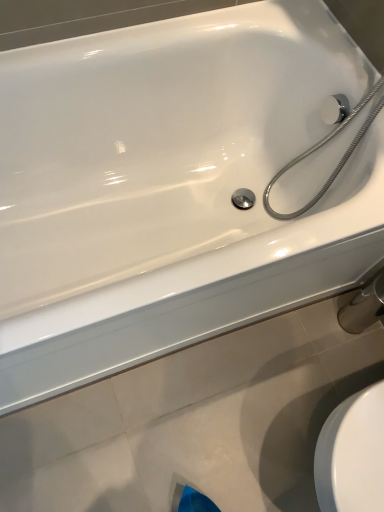
Question: Should I look upward or downward to see chrome metallic faucet at lower right?

Choices:
 (A) up
 (B) down

Answer: (B)

Question: Considering the relative sizes of chrome metallic shower head at upper right and chrome metallic faucet at lower right in the image provided, is chrome metallic shower head at upper right taller than chrome metallic faucet at lower right?

Choices:
 (A) no
 (B) yes

Answer: (B)

Question: Is the position of chrome metallic shower head at upper right less distant than that of chrome metallic faucet at lower right?

Choices:
 (A) no
 (B) yes

Answer: (B)

Question: Is chrome metallic shower head at upper right looking in the opposite direction of chrome metallic faucet at lower right?

Choices:
 (A) yes
 (B) no

Answer: (B)

Question: Could you tell me if chrome metallic shower head at upper right is turned towards chrome metallic faucet at lower right?

Choices:
 (A) yes
 (B) no

Answer: (B)

Question: Is the surface of chrome metallic shower head at upper right in direct contact with chrome metallic faucet at lower right?

Choices:
 (A) yes
 (B) no

Answer: (B)

Question: From the image's perspective, is chrome metallic shower head at upper right located above chrome metallic faucet at lower right?

Choices:
 (A) no
 (B) yes

Answer: (B)

Question: Is chrome metallic faucet at lower right looking in the opposite direction of chrome metallic shower head at upper right?

Choices:
 (A) no
 (B) yes

Answer: (A)

Question: From a real-world perspective, is chrome metallic faucet at lower right on top of chrome metallic shower head at upper right?

Choices:
 (A) no
 (B) yes

Answer: (A)

Question: From a real-world perspective, is chrome metallic faucet at lower right located beneath chrome metallic shower head at upper right?

Choices:
 (A) yes
 (B) no

Answer: (A)

Question: Can you confirm if chrome metallic faucet at lower right is positioned to the right of chrome metallic shower head at upper right?

Choices:
 (A) no
 (B) yes

Answer: (B)

Question: Is chrome metallic faucet at lower right aimed at chrome metallic shower head at upper right?

Choices:
 (A) yes
 (B) no

Answer: (B)

Question: Is chrome metallic faucet at lower right positioned before chrome metallic shower head at upper right?

Choices:
 (A) yes
 (B) no

Answer: (B)

Question: From a real-world perspective, is chrome metallic shower head at upper right above or below chrome metallic faucet at lower right?

Choices:
 (A) below
 (B) above

Answer: (B)